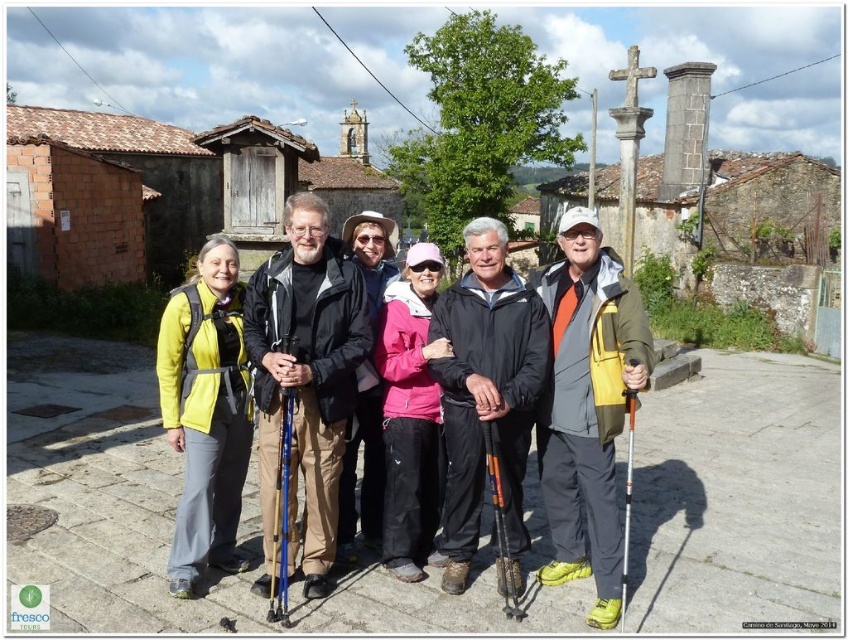
You are a photographer trying to capture a group photo of the six people in the scene. You notice the pink fabric jacket at center and the blue plastic ski pole at center. Which object is wider when viewed from your camera position?

The pink fabric jacket at center is wider than the blue plastic ski pole at center.

You are standing in the courtyard and want to walk towards the point closer to the camera between the two points, point (403,406) and point (279,474). Which point should you walk towards?

You should walk towards point (279,474) because it is closer to the camera than point (403,406).

You are a photographer trying to capture a photo of the orange textured ski pole at center without including the pink fabric jacket at center in the frame. Is this possible given their positions?

The pink fabric jacket at center is to the left of orange textured ski pole at center, so if you position yourself to the right side of the orange textured ski pole at center, you can capture the pole without the jacket in the frame.